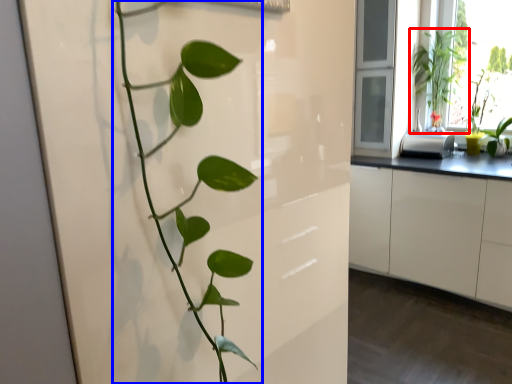
Question: Which object is closer to the camera taking this photo, houseplant (highlighted by a red box) or houseplant (highlighted by a blue box)?

Choices:
 (A) houseplant
 (B) houseplant

Answer: (B)